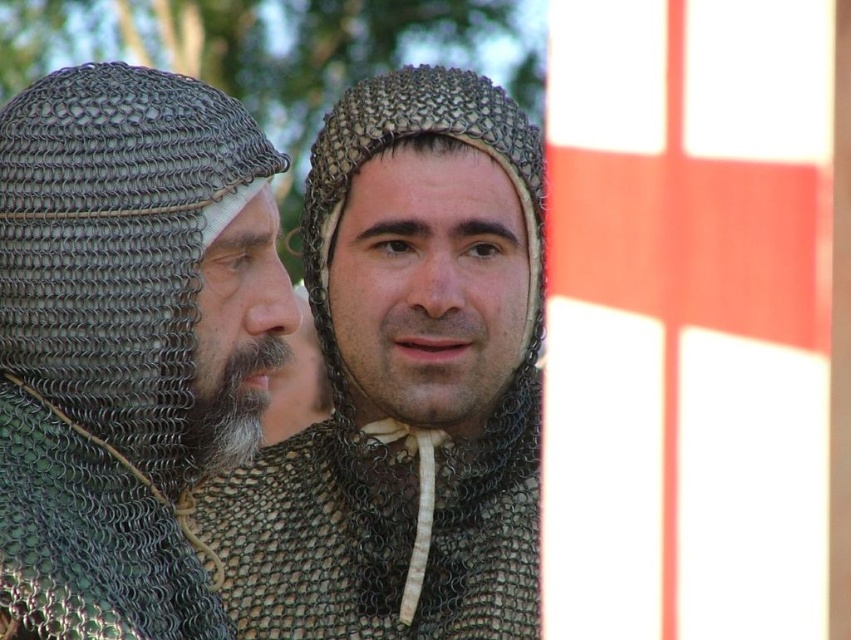
Question: Can you confirm if chainmail helmet at center is wider than chainmail helmet at left?

Choices:
 (A) yes
 (B) no

Answer: (A)

Question: Does chainmail helmet at center appear over chainmail helmet at left?

Choices:
 (A) no
 (B) yes

Answer: (B)

Question: Is chainmail helmet at center further to camera compared to chainmail helmet at left?

Choices:
 (A) no
 (B) yes

Answer: (B)

Question: Among these objects, which one is farthest from the camera?

Choices:
 (A) chainmail helmet at center
 (B) chainmail helmet at left

Answer: (A)

Question: Among these points, which one is farthest from the camera?

Choices:
 (A) (334, 170)
 (B) (236, 269)

Answer: (A)